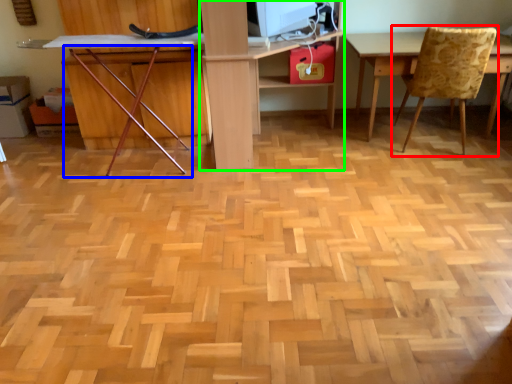
Question: Estimate the real-world distances between objects in this image. Which object is farther from chair (highlighted by a red box), chair (highlighted by a blue box) or computer desk (highlighted by a green box)?

Choices:
 (A) chair
 (B) computer desk

Answer: (A)